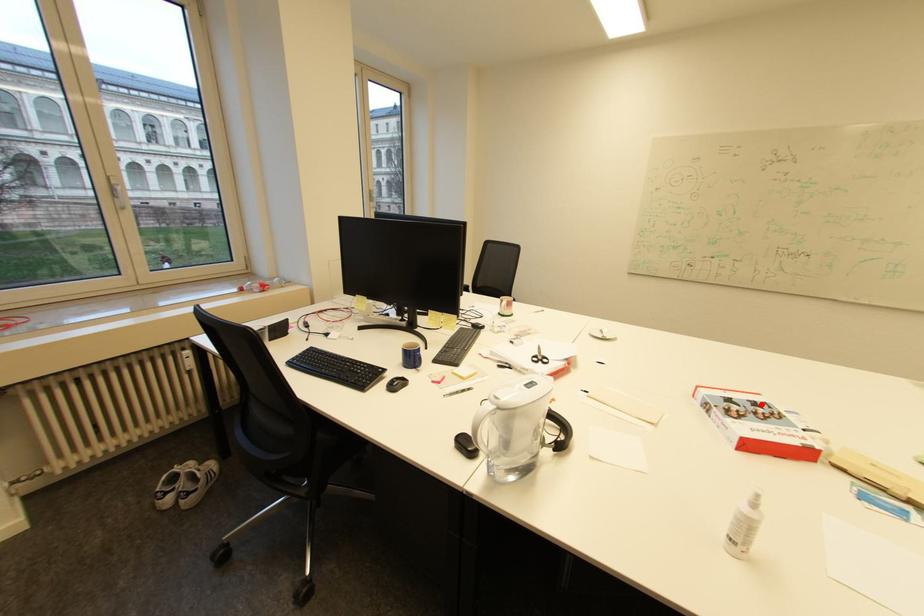
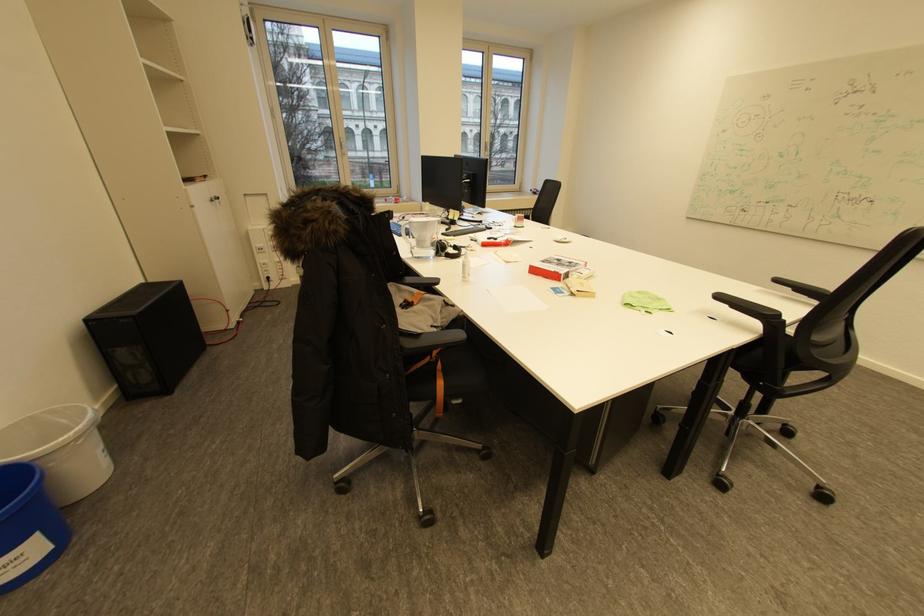
In the second image, find the point that corresponds to the highlighted location in the first image.

(576, 262)